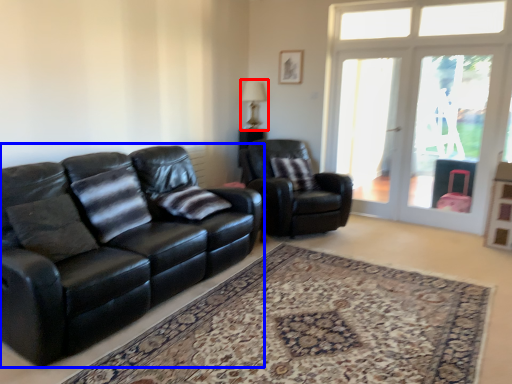
Question: Which of the following is the farthest to the observer, lamp (highlighted by a red box) or studio couch (highlighted by a blue box)?

Choices:
 (A) lamp
 (B) studio couch

Answer: (A)